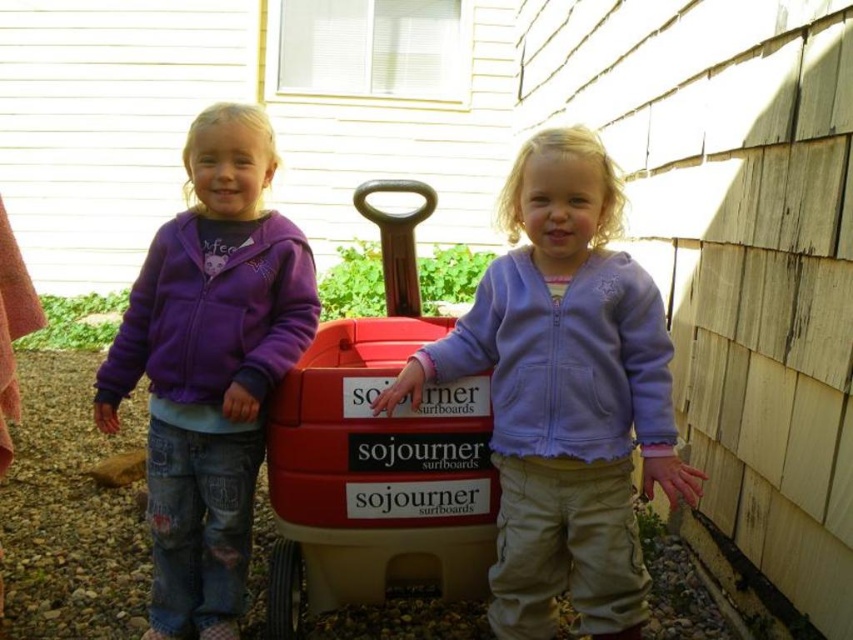
Is purple fleece jacket at center below red plastic toy car at center?

No, purple fleece jacket at center is not below red plastic toy car at center.

Between purple fleece jacket at center and red plastic toy car at center, which one is positioned lower?

red plastic toy car at center is lower down.

Between point (625, 401) and point (390, 275), which one is positioned in front?

Point (625, 401) is in front.

Where is `purple fleece jacket at center`? This screenshot has width=853, height=640. purple fleece jacket at center is located at coordinates (566, 394).

Between purple fleece jacket at center and purple fleece jacket at left, which one has less height?

Standing shorter between the two is purple fleece jacket at center.

Measure the distance from purple fleece jacket at center to purple fleece jacket at left.

28.19 inches

Describe the element at coordinates (566, 394) in the screenshot. I see `purple fleece jacket at center` at that location.

Identify the location of purple fleece jacket at center. The image size is (853, 640). (566, 394).

Looking at this image, measure the distance between purple fleece jacket at left and red plastic toy car at center.

purple fleece jacket at left is 12.26 inches away from red plastic toy car at center.

Looking at this image, is purple fleece jacket at left below red plastic toy car at center?

No, purple fleece jacket at left is not below red plastic toy car at center.

Which is in front, point (247, 244) or point (268, 618)?

Positioned in front is point (268, 618).

This screenshot has height=640, width=853. I want to click on purple fleece jacket at left, so click(210, 365).